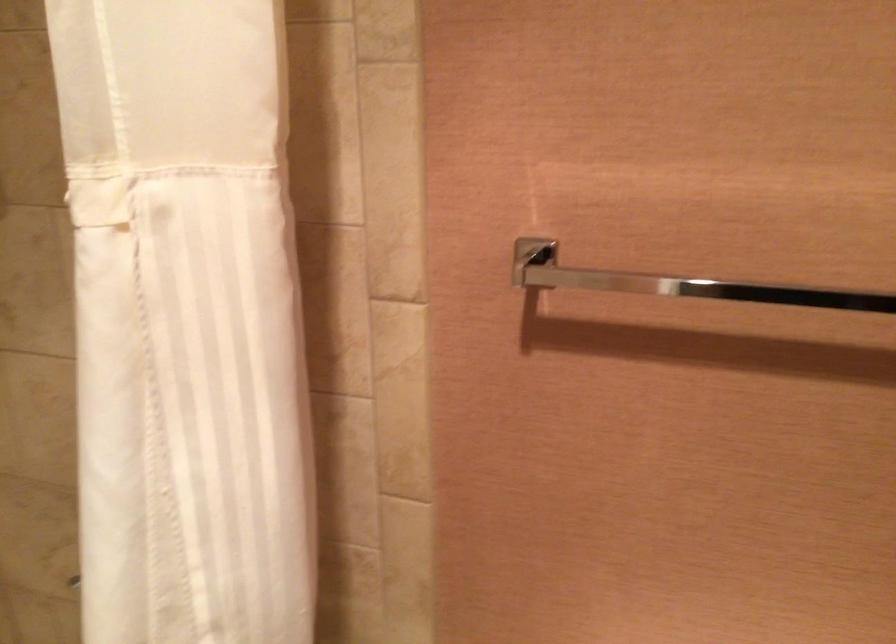
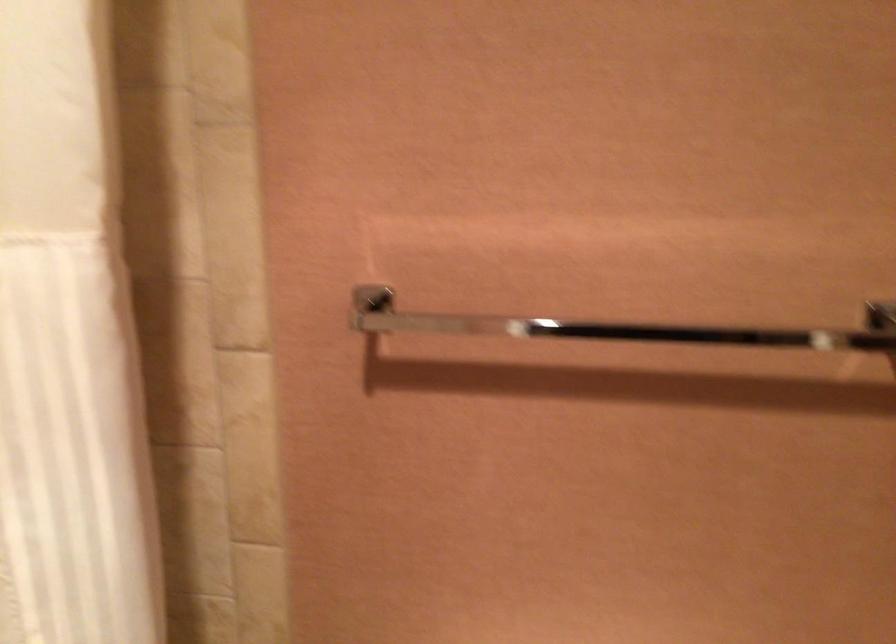
What movement of the cameraman would produce the second image?

The movement direction of the cameraman is right, backward.